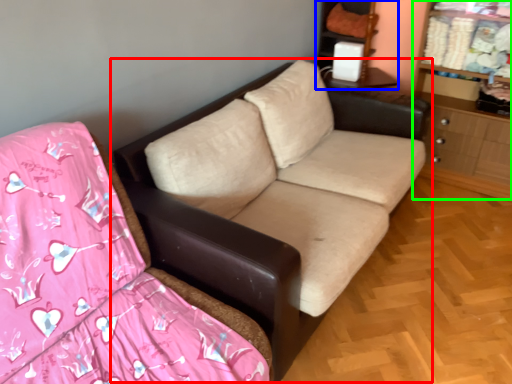
Question: Which object is positioned farthest from studio couch (highlighted by a red box)? Select from entertainment center (highlighted by a blue box) and dresser (highlighted by a green box).

Choices:
 (A) entertainment center
 (B) dresser

Answer: (A)